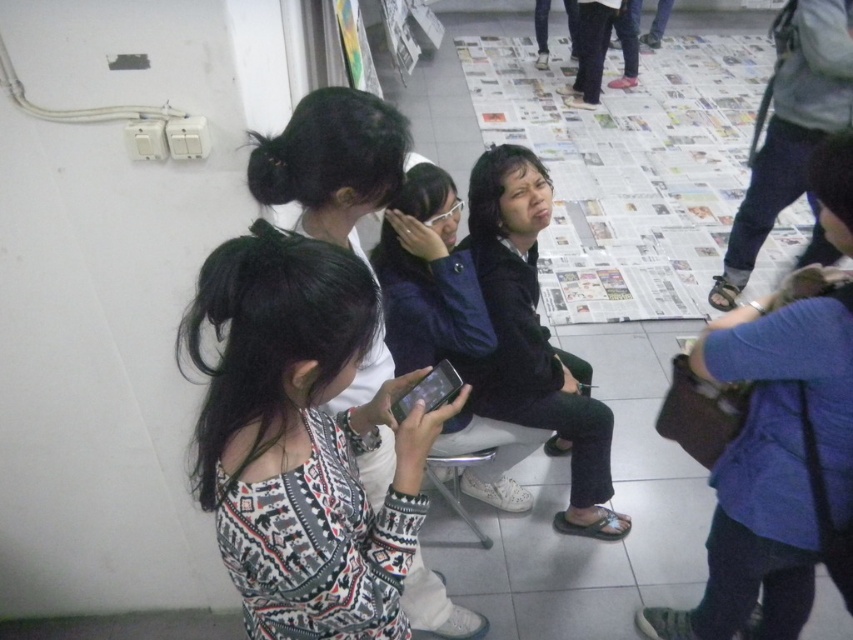
What do you see at coordinates (332, 163) in the screenshot? I see `patterned sweater at center` at bounding box center [332, 163].

Is point (367, 381) positioned after point (442, 372)?

Yes, point (367, 381) is behind point (442, 372).

Does point (263, 180) come farther from viewer compared to point (408, 401)?

Yes, point (263, 180) is farther from viewer.

Where is `patterned sweater at center`? The height and width of the screenshot is (640, 853). patterned sweater at center is located at coordinates (332, 163).

Between dark blue fabric jacket at center and patterned sweater at center, which one has more height?

dark blue fabric jacket at center

Who is more forward, (x=535, y=204) or (x=354, y=228)?

Point (x=354, y=228) is in front.

I want to click on dark blue fabric jacket at center, so click(534, 337).

Between dark blue fabric jacket at center and matte black phone at center, which one is positioned higher?

Positioned higher is dark blue fabric jacket at center.

Locate an element on the screen. dark blue fabric jacket at center is located at coordinates (534, 337).

I want to click on dark blue fabric jacket at center, so click(534, 337).